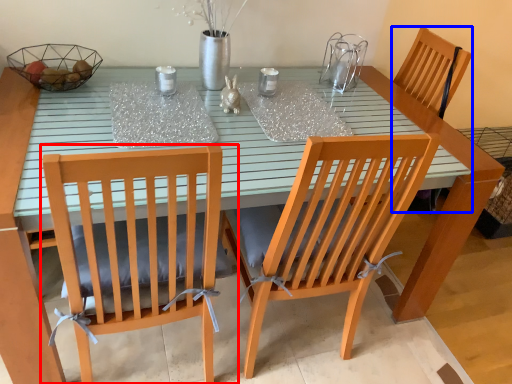
Question: Which point is closer to the camera, chair (highlighted by a red box) or armchair (highlighted by a blue box)?

Choices:
 (A) chair
 (B) armchair

Answer: (A)